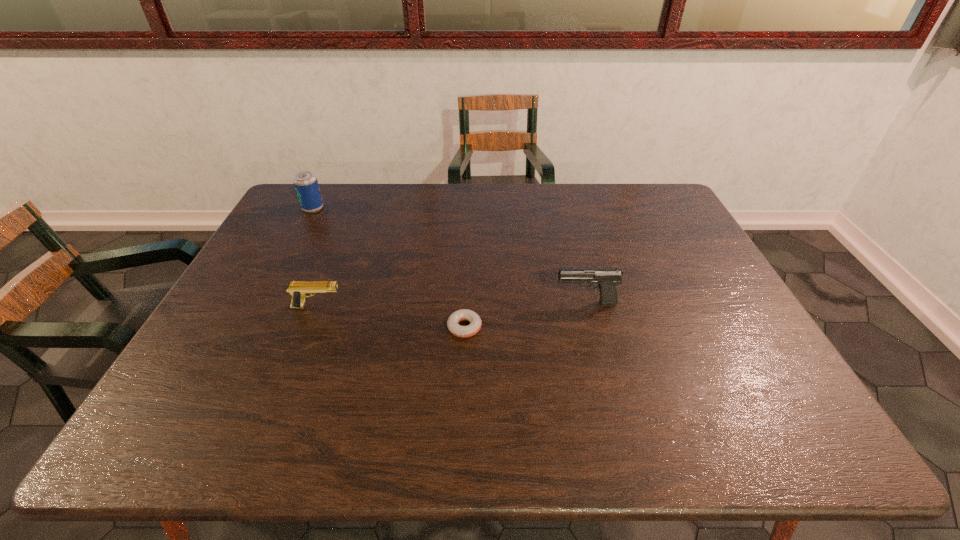
The width and height of the screenshot is (960, 540). Find the location of `free space located aim along the barrel of the taller pistol`. free space located aim along the barrel of the taller pistol is located at coordinates (480, 303).

Find the location of a particular element. vacant region located aim along the barrel of the taller pistol is located at coordinates (502, 303).

I want to click on vacant space located 0.170m at the barrel of the second shortest object, so click(x=408, y=307).

At what (x,y) coordinates should I click in order to perform the action: click on free space located on the front of the nearest object. Please return your answer as a coordinate pair (x, y). This screenshot has height=540, width=960. Looking at the image, I should click on (461, 422).

Identify the location of object situated at the far edge. The width and height of the screenshot is (960, 540). tap(305, 182).

Where is `object at the left edge`? This screenshot has height=540, width=960. object at the left edge is located at coordinates (305, 182).

The width and height of the screenshot is (960, 540). I want to click on object at the far left corner, so click(305, 182).

This screenshot has width=960, height=540. I want to click on free space at the far edge of the desktop, so click(x=428, y=216).

This screenshot has height=540, width=960. In the image, there is a desktop. Identify the location of vacant region at the left edge. pos(168,388).

I want to click on free space at the right edge of the desktop, so coord(700,325).